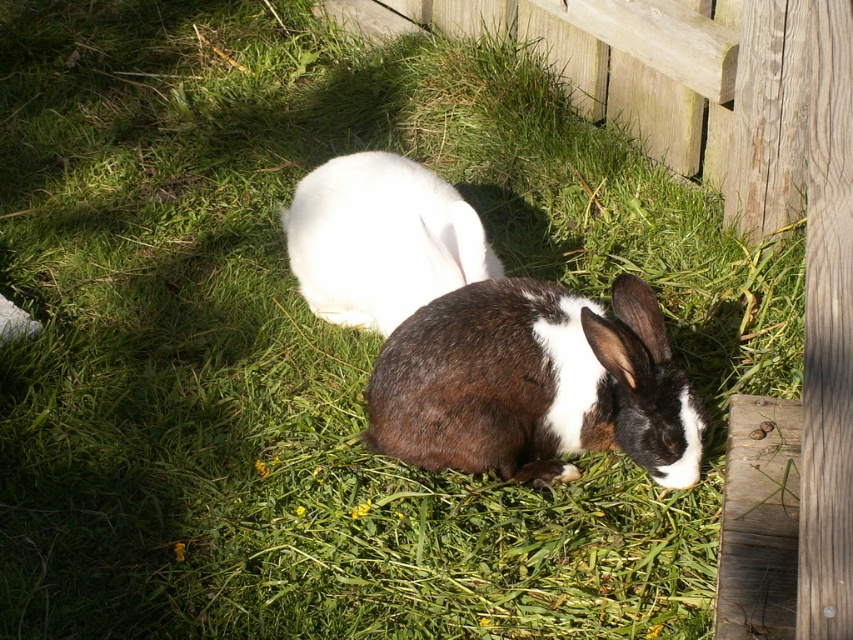
Question: Is brown fuzzy rabbit at center smaller than white fluffy rabbit at center?

Choices:
 (A) no
 (B) yes

Answer: (B)

Question: Can you confirm if brown fuzzy rabbit at center is positioned below white fluffy rabbit at center?

Choices:
 (A) no
 (B) yes

Answer: (B)

Question: Is brown fuzzy rabbit at center further to camera compared to white fluffy rabbit at center?

Choices:
 (A) no
 (B) yes

Answer: (A)

Question: Which of the following is the closest to the observer?

Choices:
 (A) (306, 192)
 (B) (512, 403)

Answer: (B)